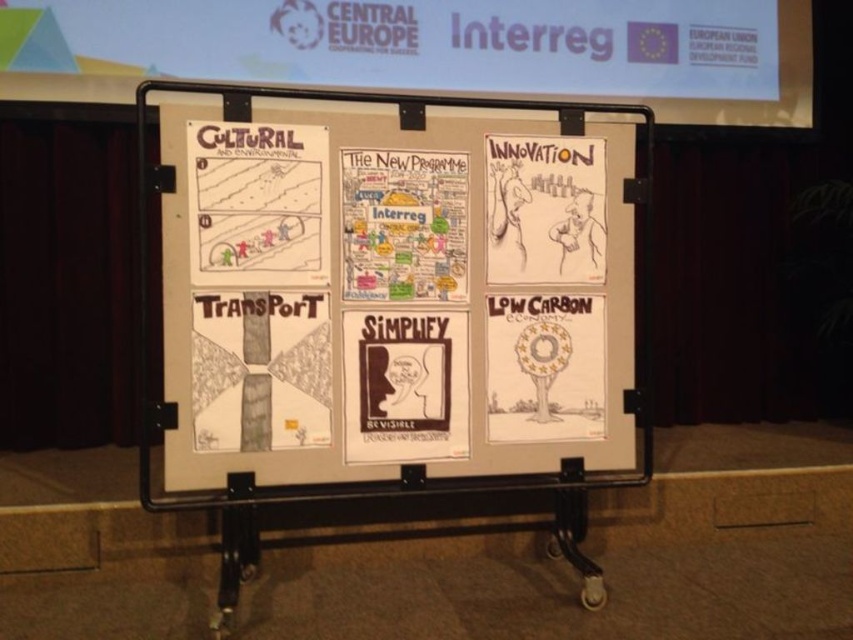
Question: Which point is farther from the camera taking this photo?

Choices:
 (A) (316, 140)
 (B) (463, 252)

Answer: (B)

Question: Does white paper at center appear over white paper tree at lower right?

Choices:
 (A) no
 (B) yes

Answer: (B)

Question: Which point is farther to the camera?

Choices:
 (A) white paper tree at lower right
 (B) white paper at center
 (C) black paper at center

Answer: (A)

Question: From the image, what is the correct spatial relationship of black ink drawing at upper left in relation to white paper poster at center?

Choices:
 (A) above
 (B) below

Answer: (A)

Question: Which object is farther from the camera taking this photo?

Choices:
 (A) white paper at upper center
 (B) white paper at center
 (C) black paper at center

Answer: (A)

Question: Does white paper poster at center appear on the left side of white paper tree at lower right?

Choices:
 (A) yes
 (B) no

Answer: (A)